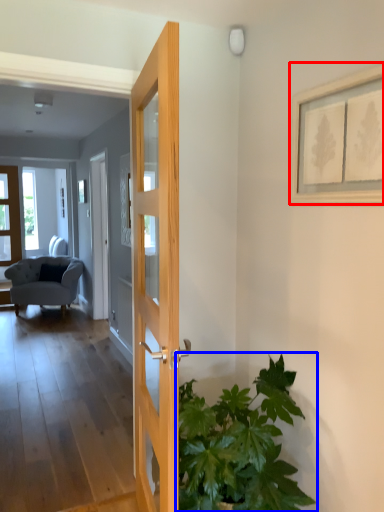
Question: Which object is further to the camera taking this photo, picture frame (highlighted by a red box) or houseplant (highlighted by a blue box)?

Choices:
 (A) picture frame
 (B) houseplant

Answer: (A)